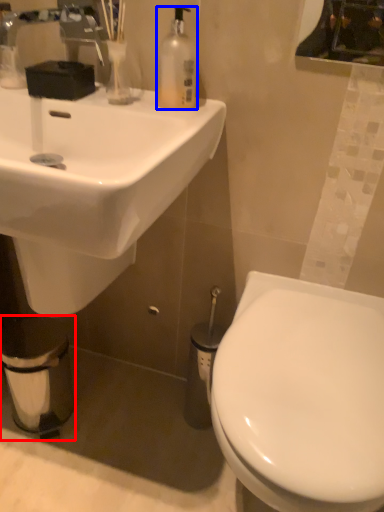
Question: Which object appears farthest to the camera in this image, toilet paper (highlighted by a red box) or bottle (highlighted by a blue box)?

Choices:
 (A) toilet paper
 (B) bottle

Answer: (A)